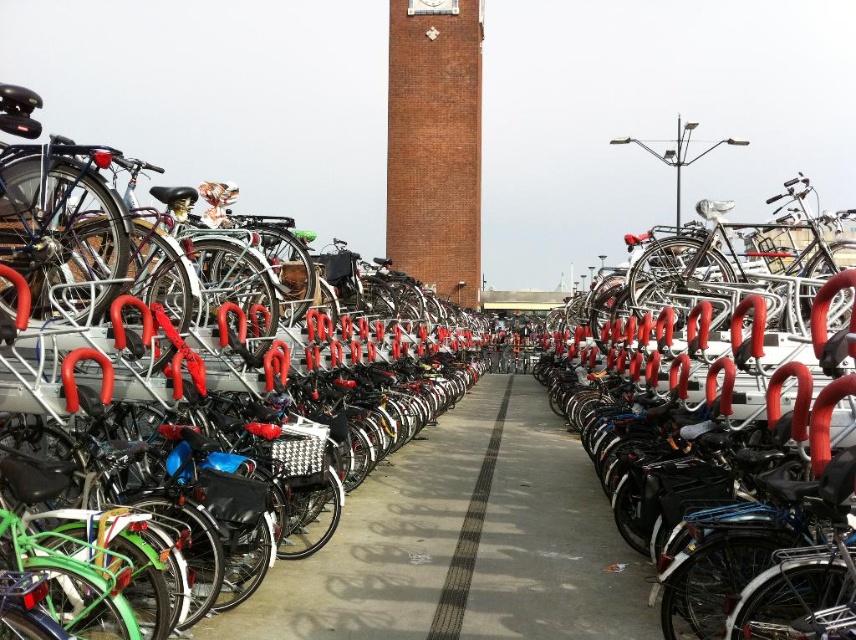
Which of these two, brick clock tower at center or black rubber line at center, stands taller?

brick clock tower at center is taller.

Is brick clock tower at center behind black rubber line at center?

That is True.

I want to click on brick clock tower at center, so click(434, 144).

Image resolution: width=856 pixels, height=640 pixels. In order to click on brick clock tower at center in this screenshot , I will do `click(434, 144)`.

Who is lower down, shiny black bicycle at right or brick clock tower at center?

shiny black bicycle at right is lower down.

Which of these two, shiny black bicycle at right or brick clock tower at center, stands shorter?

With less height is shiny black bicycle at right.

Who is more forward, (x=597, y=390) or (x=432, y=248)?

Point (x=597, y=390)

The image size is (856, 640). What are the coordinates of `shiny black bicycle at right` in the screenshot? It's located at (727, 435).

Consider the image. How distant is shiny black bicycle at right from black rubber line at center?

shiny black bicycle at right and black rubber line at center are 13.36 meters apart from each other.

This screenshot has height=640, width=856. I want to click on shiny black bicycle at right, so click(727, 435).